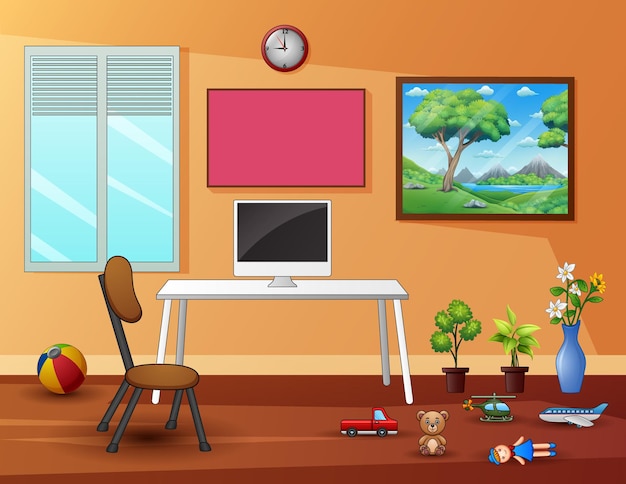
Locate an element on the screen. The image size is (626, 484). raised window blind - right side is located at coordinates (121, 75).